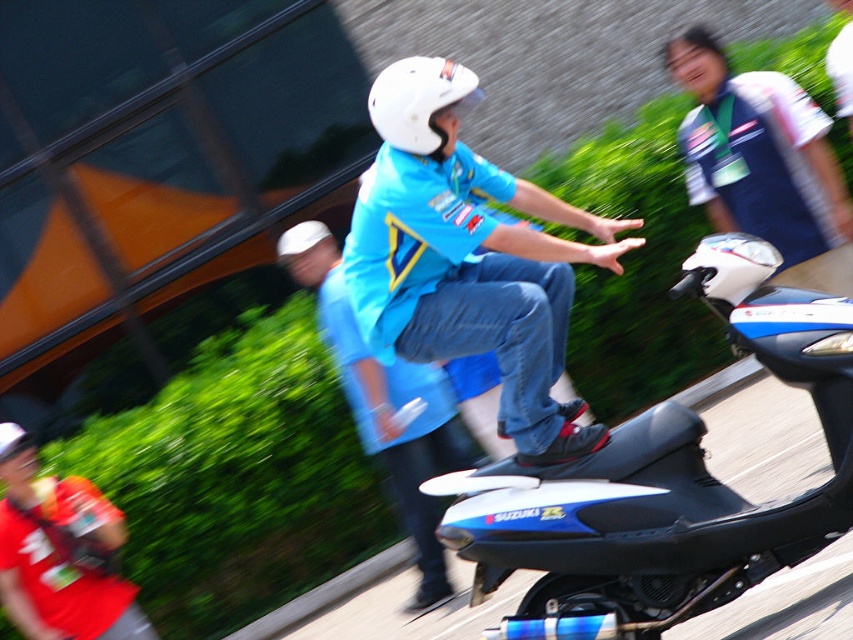
You are a photographer who wants to capture a clear photo of the rider. Since the rider is moving, you need to focus on either the blue fabric shirt at center or the white matte helmet at center. Based on their positions, which object should you focus on to ensure it stays in focus while the other might blur due to motion?

The white matte helmet at center is behind the blue fabric shirt at center, so focusing on the blue fabric shirt at center will keep it sharp while the helmet might blur if it is further away and moving differently.

You are a photographer analyzing the image. You need to determine which object, the blue fabric shirt at center or the white matte helmet at center, would be easier to focus on given their sizes. Which one would you choose and why?

The blue fabric shirt at center is larger in size than the white matte helmet at center, so it would be easier to focus on the blue fabric shirt at center because larger objects generally provide more detail for the camera to lock onto.

You are a photographer at the event and want to focus on the blue matte shirt at center without the white jersey at upper right blocking the view. Can you adjust your camera angle to achieve this?

Yes, since the blue matte shirt at center is in front of the white jersey at upper right, adjusting the camera angle slightly backward or to the side could allow focusing on the blue matte shirt at center without obstruction from the white jersey at upper right.